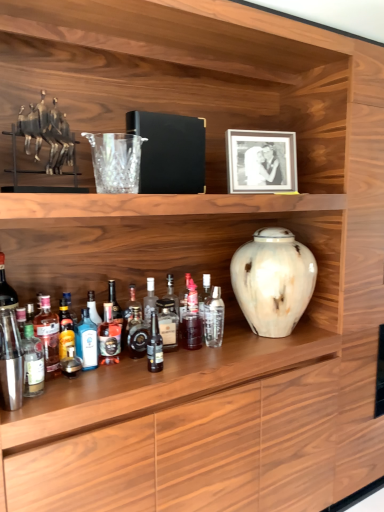
Question: From a real-world perspective, is translucent glass bottle at lower left, which ranks as the third bottle in left-to-right order, positioned over translucent glass bottle at lower left, which is the ninth bottle from right to left, based on gravity?

Choices:
 (A) no
 (B) yes

Answer: (B)

Question: Is translucent glass bottle at lower left, which ranks as the third bottle in left-to-right order, smaller than translucent glass bottle at lower left, marked as the second bottle in a left-to-right arrangement?

Choices:
 (A) yes
 (B) no

Answer: (B)

Question: Does translucent glass bottle at lower left, which ranks as the third bottle in left-to-right order, have a larger size compared to translucent glass bottle at lower left, marked as the second bottle in a left-to-right arrangement?

Choices:
 (A) yes
 (B) no

Answer: (A)

Question: Could you tell me if translucent glass bottle at lower left, marked as the eighth bottle in a right-to-left arrangement, is turned towards translucent glass bottle at lower left, which is the ninth bottle from right to left?

Choices:
 (A) no
 (B) yes

Answer: (A)

Question: Can you confirm if translucent glass bottle at lower left, which ranks as the third bottle in left-to-right order, is taller than translucent glass bottle at lower left, marked as the second bottle in a left-to-right arrangement?

Choices:
 (A) yes
 (B) no

Answer: (A)

Question: Considering their positions, is translucent glass bottle at lower left, which ranks as the third bottle in left-to-right order, located in front of or behind blue glass bottle at center, the fifth bottle from the left?

Choices:
 (A) behind
 (B) front

Answer: (B)

Question: Looking at the image, does translucent glass bottle at lower left, which ranks as the third bottle in left-to-right order, seem bigger or smaller compared to blue glass bottle at center, which is counted as the sixth bottle, starting from the right?

Choices:
 (A) small
 (B) big

Answer: (B)

Question: Is translucent glass bottle at lower left, marked as the eighth bottle in a right-to-left arrangement, spatially inside blue glass bottle at center, the fifth bottle from the left, or outside of it?

Choices:
 (A) outside
 (B) inside

Answer: (A)

Question: Considering the relative positions of translucent glass bottle at lower left, marked as the eighth bottle in a right-to-left arrangement, and blue glass bottle at center, the fifth bottle from the left, in the image provided, is translucent glass bottle at lower left, marked as the eighth bottle in a right-to-left arrangement, to the left or to the right of blue glass bottle at center, the fifth bottle from the left,?

Choices:
 (A) left
 (B) right

Answer: (A)

Question: Is translucent glass bottle at center, which appears as the fourth bottle when viewed from the right, spatially inside blue glass bottle at center, the fifth bottle from the left, or outside of it?

Choices:
 (A) outside
 (B) inside

Answer: (A)

Question: Relative to blue glass bottle at center, the fifth bottle from the left, is translucent glass bottle at center, acting as the 7th bottle starting from the left, in front or behind?

Choices:
 (A) behind
 (B) front

Answer: (B)

Question: From a real-world perspective, relative to blue glass bottle at center, the fifth bottle from the left, is translucent glass bottle at center, acting as the 7th bottle starting from the left, vertically above or below?

Choices:
 (A) below
 (B) above

Answer: (A)

Question: Would you say translucent glass bottle at center, which appears as the fourth bottle when viewed from the right, is to the left or to the right of blue glass bottle at center, which is counted as the sixth bottle, starting from the right, in the picture?

Choices:
 (A) left
 (B) right

Answer: (B)

Question: From a real-world perspective, is blue glass bottle at center, the fifth bottle from the left, positioned above or below translucent glass bottle at center, which appears as the 9th bottle when viewed from the left?

Choices:
 (A) below
 (B) above

Answer: (A)

Question: From their relative heights in the image, would you say blue glass bottle at center, which is counted as the sixth bottle, starting from the right, is taller or shorter than translucent glass bottle at center, the 2th bottle positioned from the right?

Choices:
 (A) tall
 (B) short

Answer: (B)